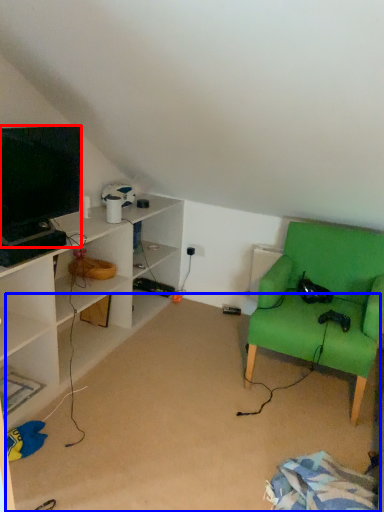
Question: Among these objects, which one is nearest to the camera, television (highlighted by a red box) or plain (highlighted by a blue box)?

Choices:
 (A) television
 (B) plain

Answer: (B)